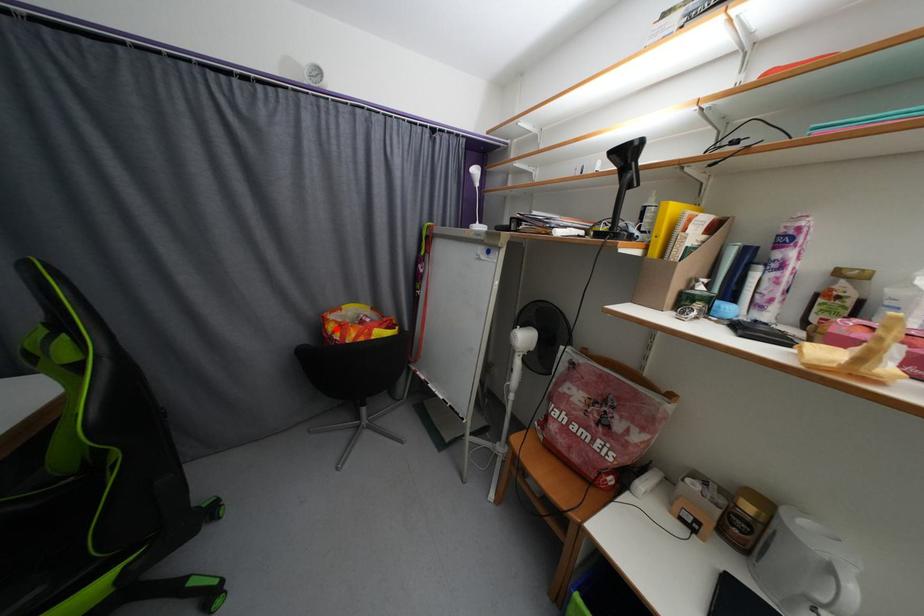
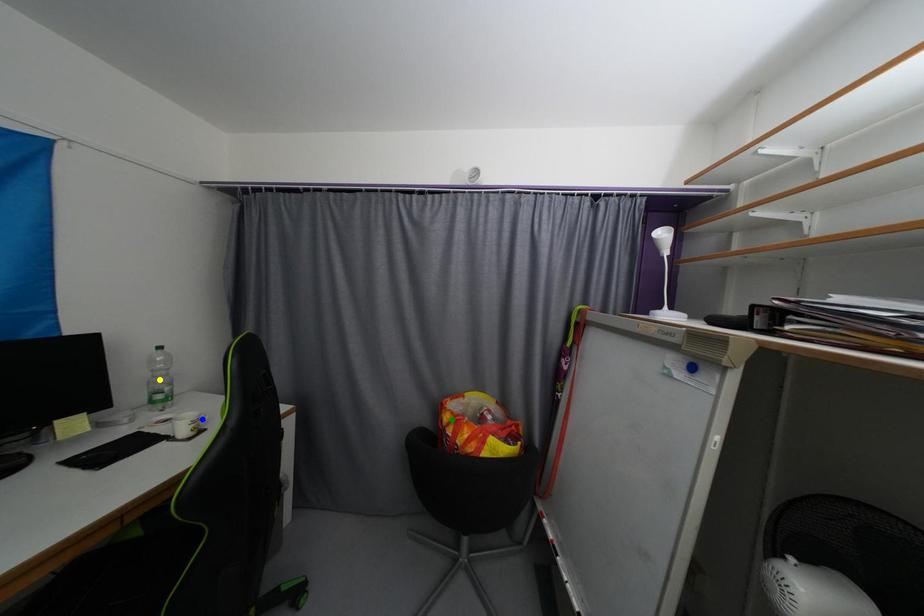
Question: I am providing you with two images of the same scene from different viewpoints. A red point is marked on the first image. You are given multiple points on the second image. Which spot in image 2 lines up with the point in image 1?

Choices:
 (A) yellow point
 (B) green point
 (C) blue point

Answer: (B)